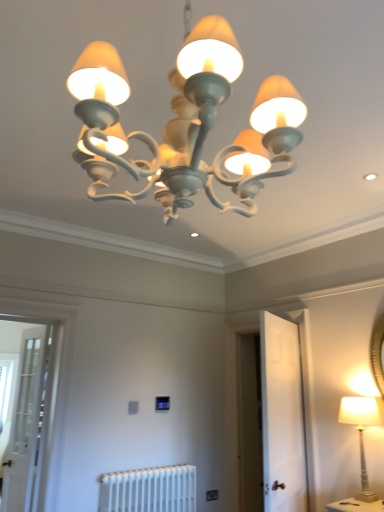
Question: Is white painted wood lamp at right, the second lamp viewed from the front, in contact with white metallic radiator at lower center?

Choices:
 (A) no
 (B) yes

Answer: (A)

Question: Can you confirm if white painted wood lamp at right, the second lamp viewed from the front, is taller than white metallic radiator at lower center?

Choices:
 (A) yes
 (B) no

Answer: (A)

Question: Could you tell me if white painted wood lamp at right, which is the second lamp in left-to-right order, is facing white metallic radiator at lower center?

Choices:
 (A) yes
 (B) no

Answer: (B)

Question: Is white painted wood lamp at right, the second lamp viewed from the top, at the left side of white metallic radiator at lower center?

Choices:
 (A) no
 (B) yes

Answer: (A)

Question: Is white painted wood lamp at right, the first lamp positioned from the back, outside white metallic radiator at lower center?

Choices:
 (A) no
 (B) yes

Answer: (B)

Question: From the image's perspective, relative to clear glass screen door at left, which is the first screen door in left-to-right order, is white painted wood lamp at right, the first lamp positioned from the right, above or below?

Choices:
 (A) above
 (B) below

Answer: (A)

Question: Looking at their shapes, would you say white painted wood lamp at right, which is the second lamp in left-to-right order, is wider or thinner than clear glass screen door at left, marked as the 2th screen door in a right-to-left arrangement?

Choices:
 (A) wide
 (B) thin

Answer: (A)

Question: In terms of size, does white painted wood lamp at right, the first lamp positioned from the back, appear bigger or smaller than clear glass screen door at left, which is the first screen door in left-to-right order?

Choices:
 (A) small
 (B) big

Answer: (A)

Question: From their relative heights in the image, would you say white painted wood lamp at right, which is the second lamp in left-to-right order, is taller or shorter than clear glass screen door at left, marked as the 2th screen door in a right-to-left arrangement?

Choices:
 (A) tall
 (B) short

Answer: (B)

Question: Is point (107, 493) closer or farther from the camera than point (296, 480)?

Choices:
 (A) farther
 (B) closer

Answer: (A)

Question: Looking at their shapes, would you say white metallic radiator at lower center is wider or thinner than white matte door at center, which ranks as the 2th screen door in left-to-right order?

Choices:
 (A) thin
 (B) wide

Answer: (B)

Question: In terms of height, does white metallic radiator at lower center look taller or shorter compared to white matte door at center, the 1th screen door viewed from the right?

Choices:
 (A) short
 (B) tall

Answer: (A)

Question: Is white metallic radiator at lower center inside the boundaries of white matte door at center, the 1th screen door viewed from the right, or outside?

Choices:
 (A) outside
 (B) inside

Answer: (A)

Question: Relative to white metallic radiator at lower center, is white painted wood lamp at right, the first lamp positioned from the right, in front or behind?

Choices:
 (A) front
 (B) behind

Answer: (A)

Question: Is white painted wood lamp at right, which is the second lamp in left-to-right order, wider or thinner than white metallic radiator at lower center?

Choices:
 (A) thin
 (B) wide

Answer: (B)